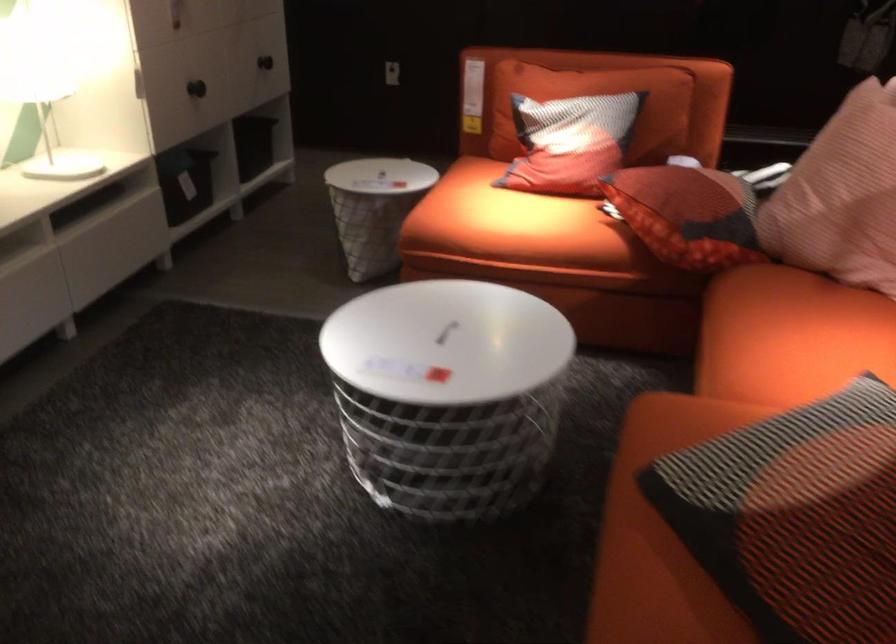
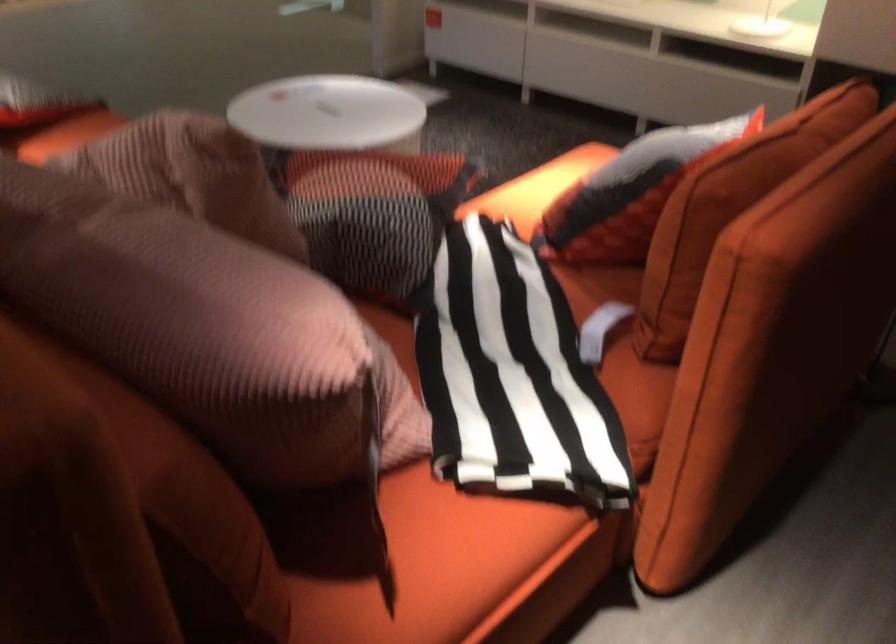
The point at [685,73] is marked in the first image. Where is the corresponding point in the second image?

(730, 207)